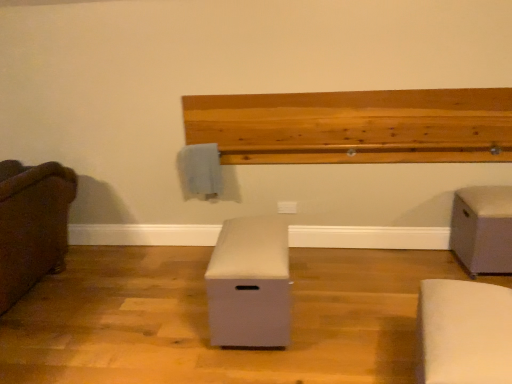
Question: From the image's perspective, relative to beige fabric ottoman at center, the 3th furniture positioned from the right, is brown fabric couch at left, marked as the 1th furniture in a left-to-right arrangement, above or below?

Choices:
 (A) below
 (B) above

Answer: (B)

Question: Looking at their shapes, would you say brown fabric couch at left, arranged as the fourth furniture when viewed from the right, is wider or thinner than beige fabric ottoman at center, the 3th furniture positioned from the right?

Choices:
 (A) wide
 (B) thin

Answer: (A)

Question: Based on their relative distances, which object is farther from the beige fabric ottoman at center, the 3th furniture positioned from the right?

Choices:
 (A) natural wood ledge at upper center
 (B) brown fabric couch at left, arranged as the fourth furniture when viewed from the right
 (C) white fabric ottoman at lower right, acting as the 2th furniture starting from the right
 (D) beige fabric ottoman at right, acting as the first furniture starting from the right

Answer: (D)

Question: Based on their relative distances, which object is farther from the beige fabric ottoman at right, acting as the first furniture starting from the right?

Choices:
 (A) natural wood ledge at upper center
 (B) beige fabric ottoman at center, marked as the 2th furniture in a left-to-right arrangement
 (C) brown fabric couch at left, arranged as the fourth furniture when viewed from the right
 (D) white fabric ottoman at lower right, which appears as the third furniture when viewed from the left

Answer: (C)